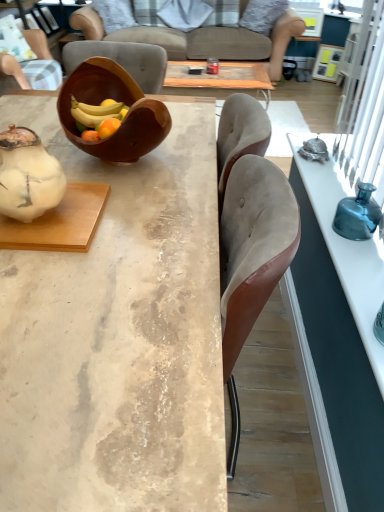
At what (x,y) coordinates should I click in order to perform the action: click on vacant space to the right of white matte teapot at left. Please return your answer as a coordinate pair (x, y). This screenshot has height=512, width=384. Looking at the image, I should click on (127, 222).